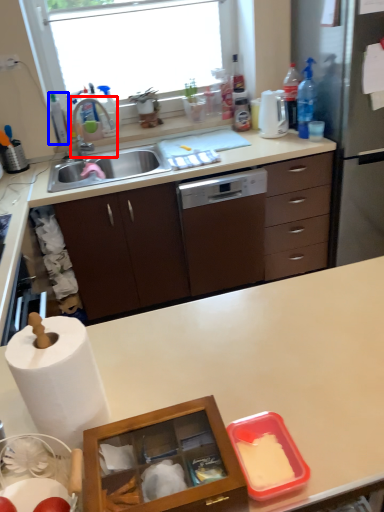
Question: Which point is closer to the camera, faucet (highlighted by a red box) or bottle (highlighted by a blue box)?

Choices:
 (A) faucet
 (B) bottle

Answer: (A)